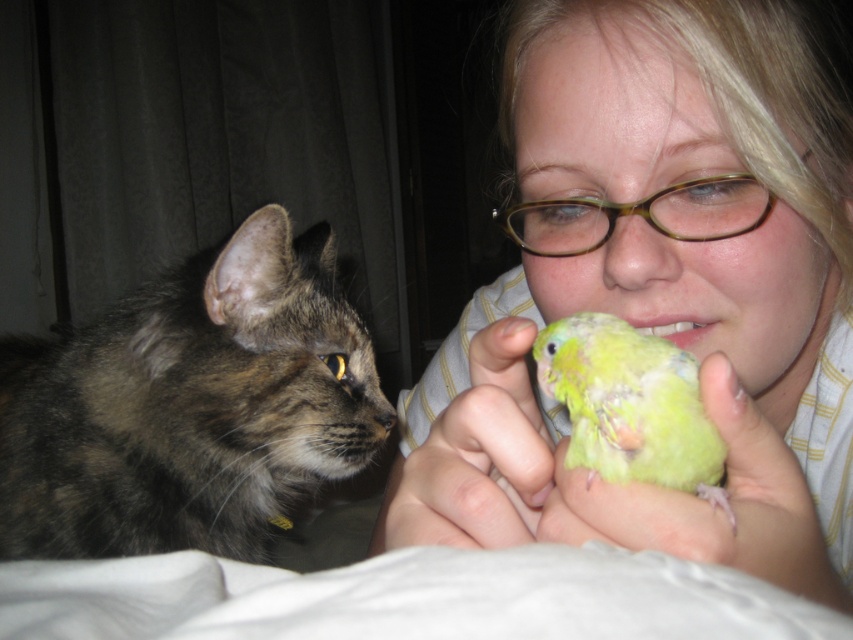
Does point (100, 328) come farther from viewer compared to point (466, 524)?

Yes, point (100, 328) is farther from viewer.

Can you confirm if tabby fur cat at left is thinner than green matte parrot at center?

Incorrect, tabby fur cat at left's width is not less than green matte parrot at center's.

Describe the element at coordinates (189, 404) in the screenshot. The image size is (853, 640). I see `tabby fur cat at left` at that location.

Find the location of `tabby fur cat at left`. tabby fur cat at left is located at coordinates (189, 404).

Is green feathered bird at center positioned in front of green feathered parrot at center?

Yes, green feathered bird at center is closer to the viewer.

Consider the image. Can you confirm if green feathered bird at center is positioned above green feathered parrot at center?

Incorrect, green feathered bird at center is not positioned above green feathered parrot at center.

Between point (846, 612) and point (572, 397), which one is positioned in front?

Point (572, 397)

Where is `green feathered bird at center`? The width and height of the screenshot is (853, 640). green feathered bird at center is located at coordinates (708, 504).

Can you confirm if green matte parrot at center is smaller than green feathered parrot at center?

No, green matte parrot at center is not smaller than green feathered parrot at center.

Describe the element at coordinates (476, 458) in the screenshot. I see `green matte parrot at center` at that location.

You are a GUI agent. You are given a task and a screenshot of the screen. Output one action in this format:
    pyautogui.click(x=<x>, y=<y>)
    Task: Click on the green matte parrot at center
    The height and width of the screenshot is (640, 853).
    Given the screenshot: What is the action you would take?
    pyautogui.click(x=476, y=458)